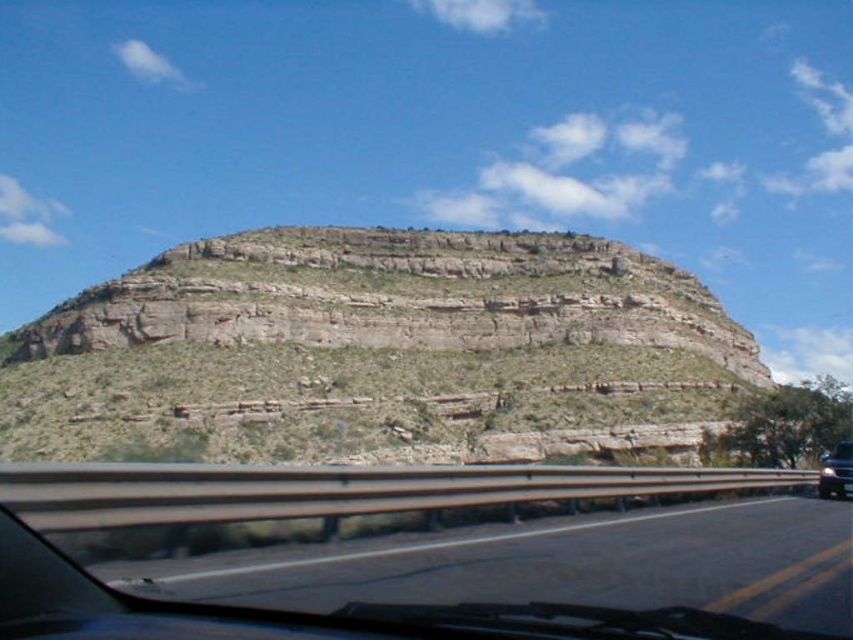
Question: Which object is positioned farthest from the black glossy car at right?

Choices:
 (A) transparent glass car window at center
 (B) brown rocky mountain at center

Answer: (B)

Question: Which of these objects is positioned farthest from the brown rocky mountain at center?

Choices:
 (A) black glossy car at right
 (B) transparent glass car window at center

Answer: (B)

Question: Can you confirm if transparent glass car window at center is positioned to the left of black glossy car at right?

Choices:
 (A) yes
 (B) no

Answer: (A)

Question: Which point is closer to the camera?

Choices:
 (A) (840, 483)
 (B) (198, 500)

Answer: (B)

Question: Can you confirm if brown rocky mountain at center is positioned above black glossy car at right?

Choices:
 (A) yes
 (B) no

Answer: (A)

Question: Is brown rocky mountain at center wider than black glossy car at right?

Choices:
 (A) no
 (B) yes

Answer: (B)